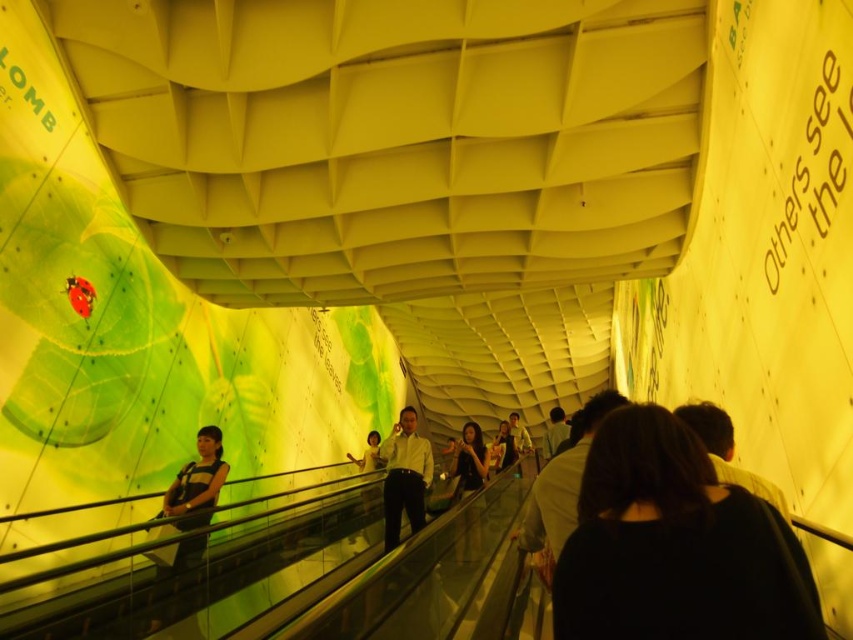
Question: Which object appears farthest from the camera in this image?

Choices:
 (A) black hair at center
 (B) matte black shirt at center

Answer: (B)

Question: Based on their relative distances, which object is farther from the black hair at center?

Choices:
 (A) light brown shirt at center
 (B) matte black shirt at center

Answer: (A)

Question: Estimate the real-world distances between objects in this image. Which object is farther from the black hair at center?

Choices:
 (A) matte black shirt at center
 (B) light brown shirt at center

Answer: (B)

Question: Does black hair at center appear under light brown shirt at center?

Choices:
 (A) no
 (B) yes

Answer: (A)

Question: Can you confirm if black hair at center is positioned above matte black shirt at center?

Choices:
 (A) no
 (B) yes

Answer: (B)

Question: Does black hair at center have a larger size compared to light brown shirt at center?

Choices:
 (A) yes
 (B) no

Answer: (B)